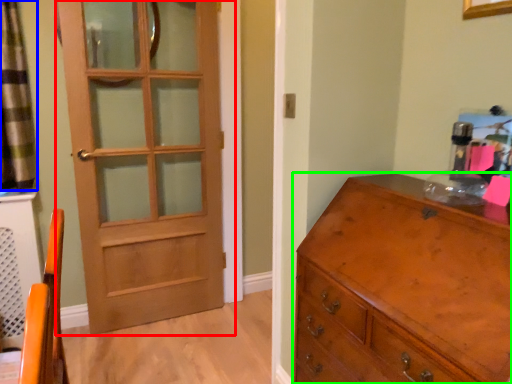
Question: Which is nearer to the door (highlighted by a red box)? curtain (highlighted by a blue box) or chest of drawers (highlighted by a green box).

Choices:
 (A) curtain
 (B) chest of drawers

Answer: (A)